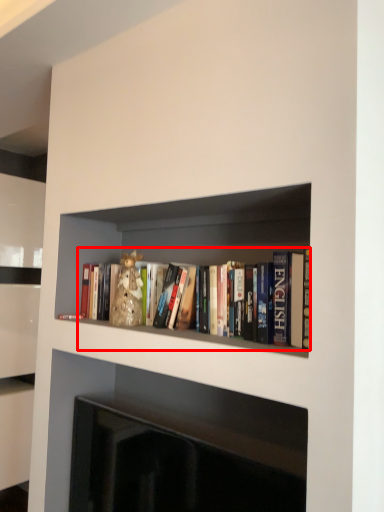
Question: Observing the image, what is the correct spatial positioning of book (annotated by the red box) in reference to fireplace?

Choices:
 (A) left
 (B) right

Answer: (B)